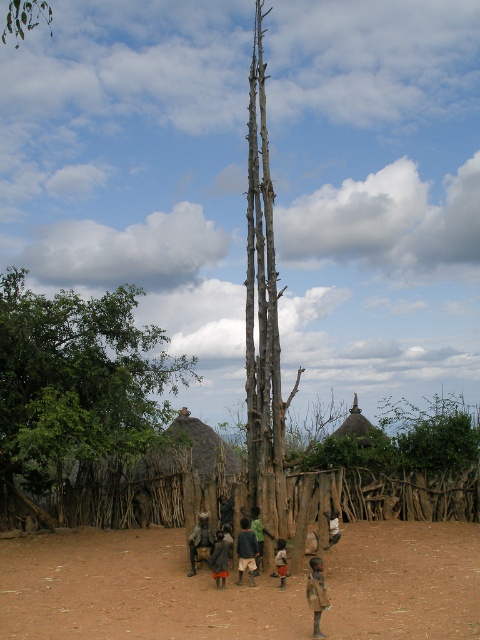
You are a traveler who just arrived at the village and you want to place your belongings in a safe spot near the tree. Where is the brown fabric bag at lower center located relative to the tree?

The brown fabric bag at lower center is located at point 0.930 on the x axis and 0.660 on the y axis relative to the tree.

You are a traveler who just arrived in this village and wants to find the tallest object in the area. Based on the scene, which object is taller between the green leafy tree at left and the dark brown wooden person at center?

The green leafy tree at left is taller than the dark brown wooden person at center.